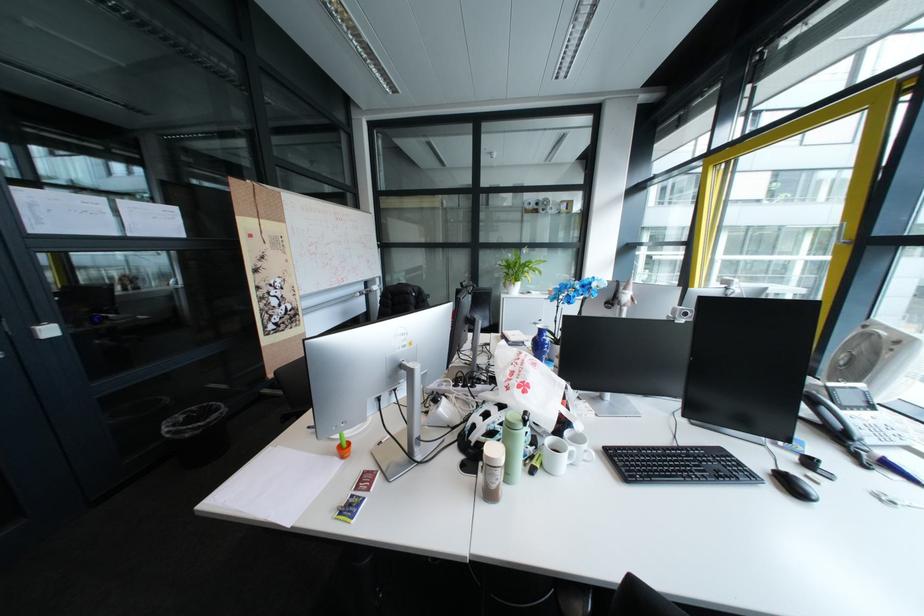
The width and height of the screenshot is (924, 616). What are the coordinates of `telephone handset` in the screenshot? It's located at (829, 414).